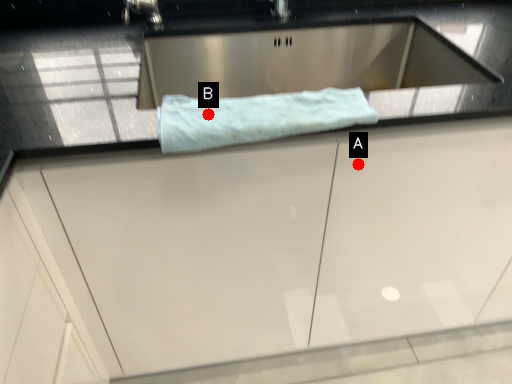
Question: Two points are circled on the image, labeled by A and B beside each circle. Which point is farther from the camera taking this photo?

Choices:
 (A) A is further
 (B) B is further

Answer: (A)